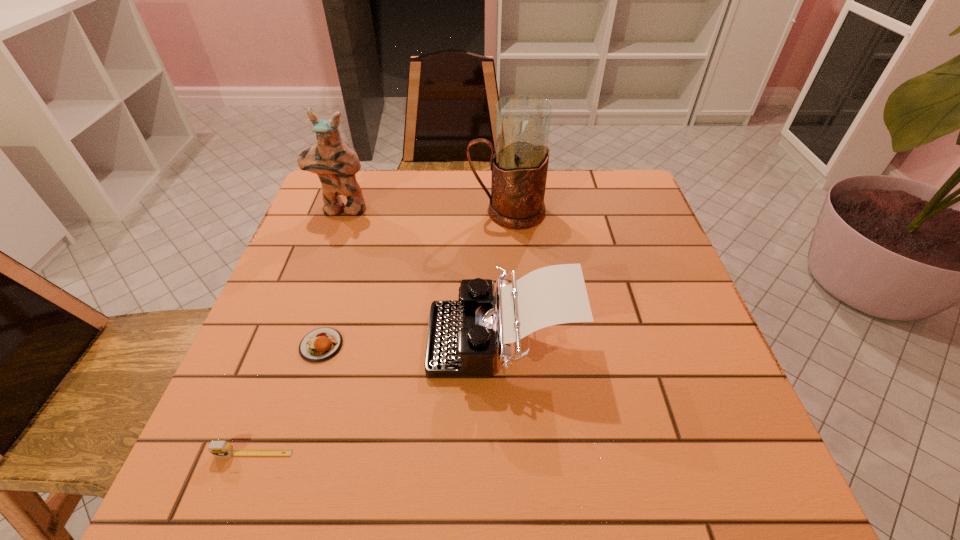
The height and width of the screenshot is (540, 960). In order to click on pitcher in this screenshot , I will do `click(519, 166)`.

Where is `figurine`? figurine is located at coordinates (333, 160).

The image size is (960, 540). In order to click on typewriter in this screenshot , I will do `click(462, 335)`.

The height and width of the screenshot is (540, 960). Find the location of `the nearest object`. the nearest object is located at coordinates (217, 448).

Find the location of a particular element. The width and height of the screenshot is (960, 540). the fourth tallest object is located at coordinates (217, 448).

Locate an element on the screen. The image size is (960, 540). patty (food) is located at coordinates (321, 344).

The height and width of the screenshot is (540, 960). Identify the location of free region located with the handle on the side of the pitcher. (343, 212).

Locate an element on the screen. vacant space located with the handle on the side of the pitcher is located at coordinates (335, 212).

The height and width of the screenshot is (540, 960). Find the location of `free spot located with the handle on the side of the pitcher`. free spot located with the handle on the side of the pitcher is located at coordinates (443, 212).

The height and width of the screenshot is (540, 960). I want to click on vacant space positioned 0.150m on the front-facing side of the figurine, so click(x=324, y=257).